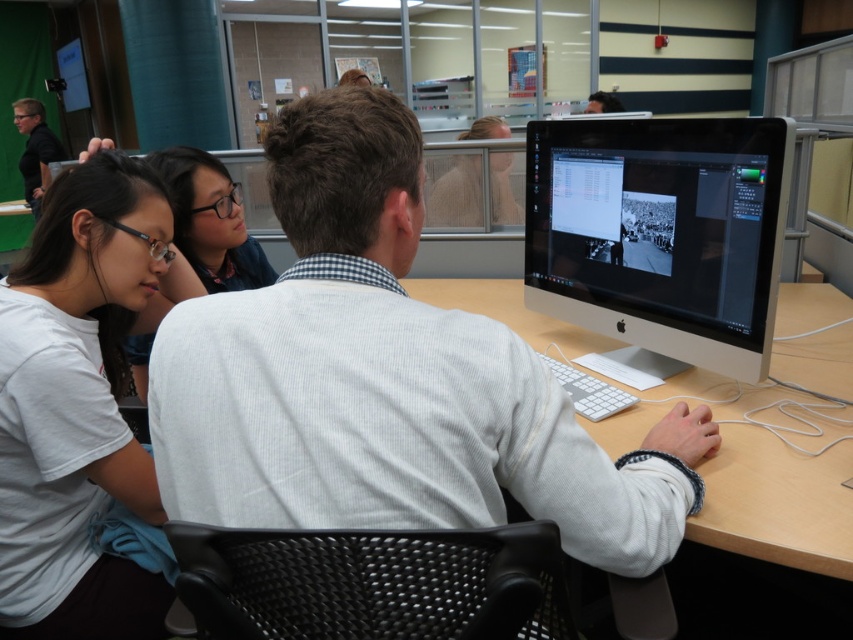
Describe the element at coordinates (752, 476) in the screenshot. I see `white plastic computer desk at center` at that location.

From the picture: Can you confirm if white plastic computer desk at center is thinner than matte black glasses at upper left?

In fact, white plastic computer desk at center might be wider than matte black glasses at upper left.

The image size is (853, 640). Describe the element at coordinates (752, 476) in the screenshot. I see `white plastic computer desk at center` at that location.

This screenshot has height=640, width=853. In order to click on white plastic computer desk at center in this screenshot , I will do `click(752, 476)`.

Is white ribbed sweater at center to the left of white matte shirt at upper left from the viewer's perspective?

No, white ribbed sweater at center is not to the left of white matte shirt at upper left.

Can you confirm if white ribbed sweater at center is smaller than white matte shirt at upper left?

No, white ribbed sweater at center is not smaller than white matte shirt at upper left.

What do you see at coordinates (387, 378) in the screenshot? I see `white ribbed sweater at center` at bounding box center [387, 378].

Where is `white ribbed sweater at center`? white ribbed sweater at center is located at coordinates (387, 378).

Which of these two, white matte shirt at upper left or white plastic computer desk at center, stands shorter?

white plastic computer desk at center

Consider the image. Is white matte shirt at upper left to the right of white plastic computer desk at center from the viewer's perspective?

In fact, white matte shirt at upper left is to the left of white plastic computer desk at center.

The width and height of the screenshot is (853, 640). In order to click on white matte shirt at upper left in this screenshot , I will do `click(77, 406)`.